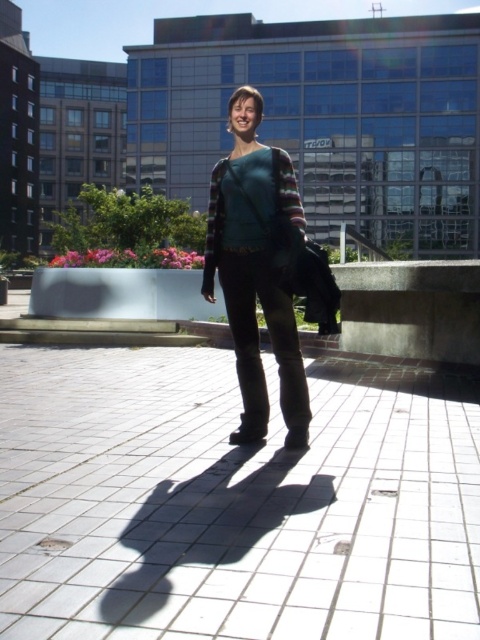
In the scene shown: Between matte teal sweater at center and teal knitted sweater at center, which one is positioned higher?

teal knitted sweater at center is higher up.

Is point (291, 401) positioned in front of point (208, 211)?

That is False.

Locate an element on the screen. The width and height of the screenshot is (480, 640). matte teal sweater at center is located at coordinates tap(256, 268).

What do you see at coordinates (229, 502) in the screenshot? I see `white tile pavement at center` at bounding box center [229, 502].

Can you confirm if white tile pavement at center is smaller than teal knitted sweater at center?

Yes.

Which is in front, point (203, 536) or point (284, 173)?

Point (203, 536)

Find the location of a particular element. Image resolution: width=480 pixels, height=640 pixels. white tile pavement at center is located at coordinates (229, 502).

Based on the photo, can you confirm if white tile pavement at center is positioned below matte teal sweater at center?

Yes.

Is white tile pavement at center bigger than matte teal sweater at center?

Actually, white tile pavement at center might be smaller than matte teal sweater at center.

The width and height of the screenshot is (480, 640). Identify the location of white tile pavement at center. (229, 502).

The image size is (480, 640). What are the coordinates of `white tile pavement at center` in the screenshot? It's located at click(x=229, y=502).